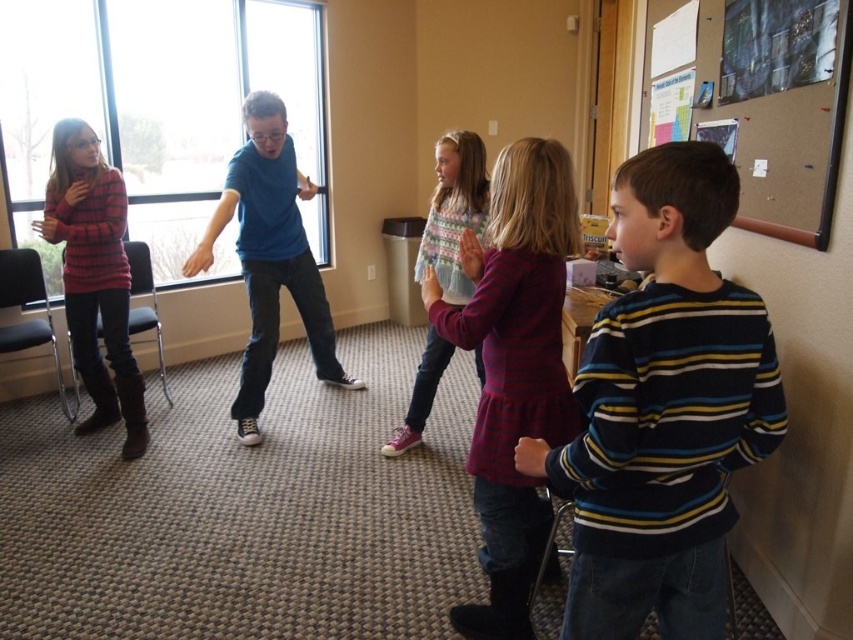
Question: Which point appears farthest from the camera in this image?

Choices:
 (A) (500, 244)
 (B) (67, 1)
 (C) (618, 396)
 (D) (235, 200)

Answer: (B)

Question: Can you confirm if striped cotton dress at center is positioned above blue cotton shirt at center?

Choices:
 (A) no
 (B) yes

Answer: (A)

Question: Which point appears closest to the camera in this image?

Choices:
 (A) (524, 432)
 (B) (277, 305)
 (C) (589, 552)

Answer: (C)

Question: Is striped cotton shirt at right to the left of pastel knitted sweater at center from the viewer's perspective?

Choices:
 (A) no
 (B) yes

Answer: (A)

Question: Does striped cotton shirt at right appear on the right side of pastel knitted sweater at center?

Choices:
 (A) no
 (B) yes

Answer: (B)

Question: Which object is the closest to the striped cotton shirt at right?

Choices:
 (A) transparent glass window at left
 (B) blue cotton shirt at center
 (C) pastel knitted sweater at center

Answer: (C)